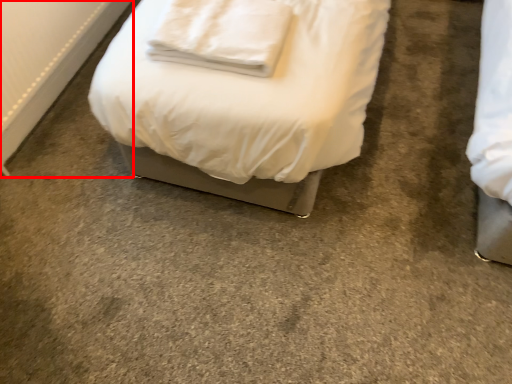
Question: From the image's perspective, where is radiator (annotated by the red box) located in relation to pillow in the image?

Choices:
 (A) above
 (B) below

Answer: (A)